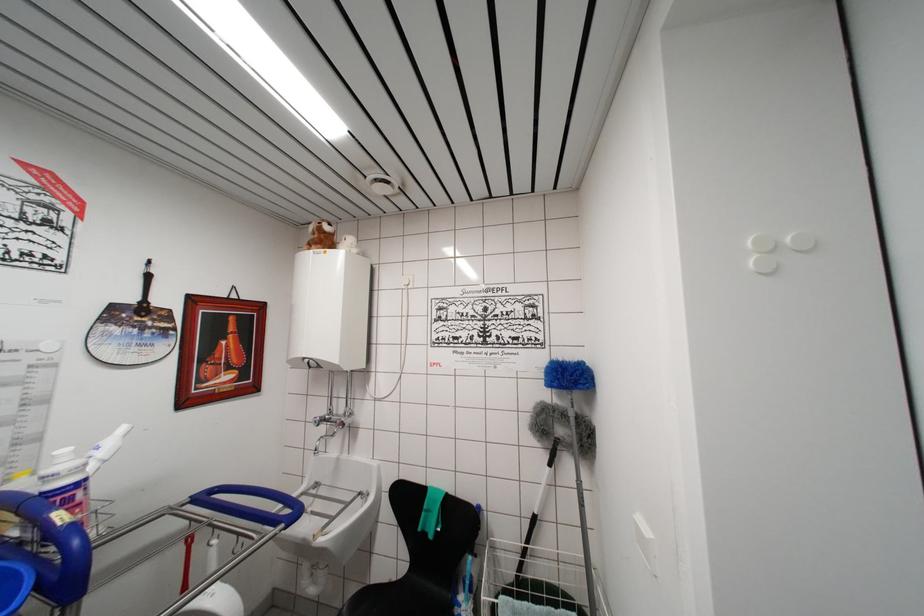
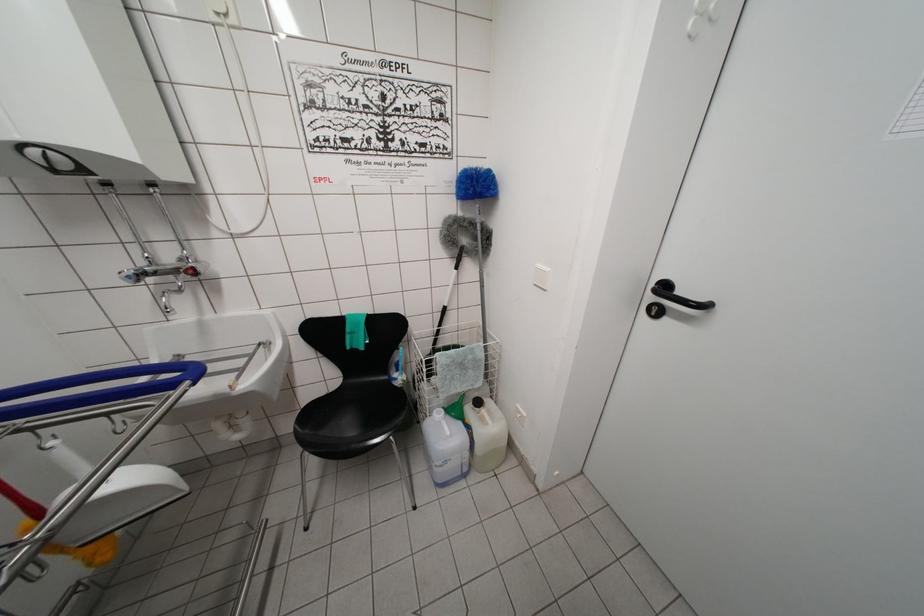
The point at [319,426] is marked in the first image. Where is the corresponding point in the second image?

(131, 282)